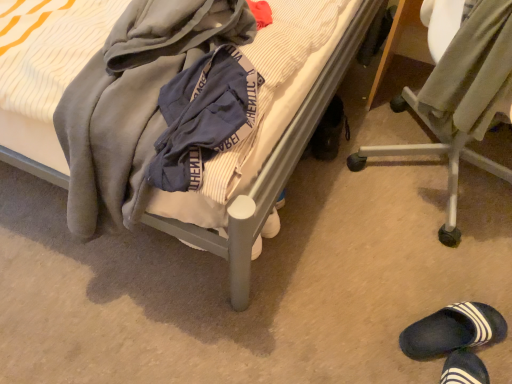
In order to face metallic silver chair at lower right, should I rotate leftwards or rightwards?

Turn right approximately 28.414 degrees to face it.

What is the approximate height of light olive-green fabric at right, which is the first clothing in right-to-left order?

light olive-green fabric at right, which is the first clothing in right-to-left order, is 14.81 inches tall.

Image resolution: width=512 pixels, height=384 pixels. What do you see at coordinates (271, 170) in the screenshot? I see `soft gray blanket at center` at bounding box center [271, 170].

You are a GUI agent. You are given a task and a screenshot of the screen. Output one action in this format:
    pyautogui.click(x=<x>, y=<y>)
    Task: Click on the metallic silver chair at lower right
    The width and height of the screenshot is (512, 384).
    Given the screenshot: What is the action you would take?
    pyautogui.click(x=458, y=93)

Which object is further away from the camera, metallic silver chair at lower right or soft gray blanket at center?

Positioned behind is metallic silver chair at lower right.

Measure the distance between metallic silver chair at lower right and soft gray blanket at center.

The distance of metallic silver chair at lower right from soft gray blanket at center is 14.63 inches.

The width and height of the screenshot is (512, 384). Find the location of `chair below the soft gray blanket at center (from a real-world perspective)`. chair below the soft gray blanket at center (from a real-world perspective) is located at coordinates pyautogui.click(x=458, y=93).

Which is correct: metallic silver chair at lower right is inside soft gray blanket at center, or outside of it?

metallic silver chair at lower right is spatially situated outside soft gray blanket at center.

Would you say black rubber shoe at lower right, positioned as the second footwear in right-to-left order, is a long distance from light olive-green fabric at right, which is the second clothing in left-to-right order?

Actually, black rubber shoe at lower right, positioned as the second footwear in right-to-left order, and light olive-green fabric at right, which is the second clothing in left-to-right order, are a little close together.

Considering the positions of point (345, 132) and point (482, 122), is point (345, 132) closer or farther from the camera than point (482, 122)?

Point (345, 132) is farther from the camera than point (482, 122).

Is black rubber shoe at lower right, acting as the 2th footwear starting from the front, bigger than light olive-green fabric at right, which is the first clothing in right-to-left order?

No, black rubber shoe at lower right, acting as the 2th footwear starting from the front, is not bigger than light olive-green fabric at right, which is the first clothing in right-to-left order.

Can we say black rubber shoe at lower right, marked as the first footwear in a left-to-right arrangement, lies outside light olive-green fabric at right, which is the second clothing in left-to-right order?

Yes, black rubber shoe at lower right, marked as the first footwear in a left-to-right arrangement, is not within light olive-green fabric at right, which is the second clothing in left-to-right order.

Could you tell me if dark blue rubber slipper at lower right, the 2th footwear from the top, is facing metallic silver chair at lower right?

No, dark blue rubber slipper at lower right, the 2th footwear from the top, is not aimed at metallic silver chair at lower right.

Is point (436, 343) more distant than point (468, 140)?

Yes, point (436, 343) is farther from viewer.

From a real-world perspective, which object rests below the other?

dark blue rubber slipper at lower right, which appears as the 1th footwear when viewed from the front.

Is dark blue rubber slipper at lower right, marked as the 1th footwear in a right-to-left arrangement, positioned beyond the bounds of metallic silver chair at lower right?

Indeed, dark blue rubber slipper at lower right, marked as the 1th footwear in a right-to-left arrangement, is completely outside metallic silver chair at lower right.

Who is bigger, light olive-green fabric at right, which is the second clothing in left-to-right order, or soft gray hoodie at center, acting as the first clothing starting from the left?

Bigger between the two is light olive-green fabric at right, which is the second clothing in left-to-right order.

Does point (511, 20) lie behind point (175, 25)?

That is False.

Which is correct: light olive-green fabric at right, which is the first clothing in right-to-left order, is inside soft gray hoodie at center, acting as the first clothing starting from the left, or outside of it?

light olive-green fabric at right, which is the first clothing in right-to-left order, is spatially situated outside soft gray hoodie at center, acting as the first clothing starting from the left.

Which of these two, light olive-green fabric at right, which is the second clothing in left-to-right order, or soft gray hoodie at center, acting as the first clothing starting from the left, stands taller?

light olive-green fabric at right, which is the second clothing in left-to-right order.

In terms of height, does soft gray blanket at center look taller or shorter compared to dark blue rubber slipper at lower right, the first footwear ordered from the bottom?

Considering their sizes, soft gray blanket at center has more height than dark blue rubber slipper at lower right, the first footwear ordered from the bottom.

Considering the positions of point (259, 203) and point (468, 305), is point (259, 203) closer or farther from the camera than point (468, 305)?

Point (259, 203).

From the image's perspective, does soft gray blanket at center appear lower than dark blue rubber slipper at lower right, marked as the 1th footwear in a right-to-left arrangement?

No.

Which object is more forward, soft gray blanket at center or dark blue rubber slipper at lower right, marked as the 1th footwear in a right-to-left arrangement?

soft gray blanket at center.

From the image's perspective, which one is positioned higher, soft gray hoodie at center, the 2th clothing viewed from the right, or dark blue rubber slipper at lower right, the 2th footwear from the left?

soft gray hoodie at center, the 2th clothing viewed from the right, is shown above in the image.

Is soft gray hoodie at center, acting as the first clothing starting from the left, next to dark blue rubber slipper at lower right, the 2th footwear positioned from the back?

No, soft gray hoodie at center, acting as the first clothing starting from the left, is not beside dark blue rubber slipper at lower right, the 2th footwear positioned from the back.

Based on their positions, is soft gray hoodie at center, acting as the first clothing starting from the left, located to the left or right of dark blue rubber slipper at lower right, which appears as the 1th footwear when viewed from the front?

From the image, it's evident that soft gray hoodie at center, acting as the first clothing starting from the left, is to the left of dark blue rubber slipper at lower right, which appears as the 1th footwear when viewed from the front.

Which object is positioned more to the left, metallic silver chair at lower right or dark blue rubber slipper at lower right, marked as the 1th footwear in a right-to-left arrangement?

Positioned to the left is dark blue rubber slipper at lower right, marked as the 1th footwear in a right-to-left arrangement.

Considering their positions, is metallic silver chair at lower right located in front of or behind dark blue rubber slipper at lower right, which appears as the 1th footwear when viewed from the front?

metallic silver chair at lower right is in front of dark blue rubber slipper at lower right, which appears as the 1th footwear when viewed from the front.

Is metallic silver chair at lower right shorter than dark blue rubber slipper at lower right, marked as the 1th footwear in a right-to-left arrangement?

No, metallic silver chair at lower right is not shorter than dark blue rubber slipper at lower right, marked as the 1th footwear in a right-to-left arrangement.

The width and height of the screenshot is (512, 384). I want to click on bed on the left of the metallic silver chair at lower right, so click(271, 170).

You are a GUI agent. You are given a task and a screenshot of the screen. Output one action in this format:
    pyautogui.click(x=<x>, y=<y>)
    Task: Click on the clothing that is the 1st object above the black rubber shoe at lower right, marked as the first footwear in a left-to-right arrangement (from a real-world perspective)
    
    Given the screenshot: What is the action you would take?
    pyautogui.click(x=473, y=72)

Estimate the real-world distances between objects in this image. Which object is closer to soft gray hoodie at center, acting as the first clothing starting from the left, black rubber shoe at lower right, which is counted as the 2th footwear, starting from the bottom, or soft gray blanket at center?

The object closer to soft gray hoodie at center, acting as the first clothing starting from the left, is soft gray blanket at center.

Looking at the image, which one is located closer to light olive-green fabric at right, which is the second clothing in left-to-right order, black rubber shoe at lower right, which appears as the 1th footwear when viewed from the back, or dark blue rubber slipper at lower right, marked as the 1th footwear in a right-to-left arrangement?

dark blue rubber slipper at lower right, marked as the 1th footwear in a right-to-left arrangement.

From the image, which object appears to be farther from soft gray hoodie at center, the 2th clothing viewed from the right, black rubber shoe at lower right, which appears as the 1th footwear when viewed from the back, or dark blue rubber slipper at lower right, the first footwear ordered from the bottom?

dark blue rubber slipper at lower right, the first footwear ordered from the bottom.

Estimate the real-world distances between objects in this image. Which object is closer to metallic silver chair at lower right, black rubber shoe at lower right, the 1th footwear from the top, or light olive-green fabric at right, which is the second clothing in left-to-right order?

light olive-green fabric at right, which is the second clothing in left-to-right order, is closer to metallic silver chair at lower right.

Looking at the image, which one is located further to soft gray hoodie at center, the 2th clothing viewed from the right, dark blue rubber slipper at lower right, the 2th footwear positioned from the back, or black rubber shoe at lower right, which appears as the 1th footwear when viewed from the back?

The object further to soft gray hoodie at center, the 2th clothing viewed from the right, is dark blue rubber slipper at lower right, the 2th footwear positioned from the back.

Considering their positions, is black rubber shoe at lower right, which appears as the 1th footwear when viewed from the back, positioned closer to dark blue rubber slipper at lower right, the 2th footwear from the left, than soft gray blanket at center?

Among the two, soft gray blanket at center is located nearer to dark blue rubber slipper at lower right, the 2th footwear from the left.

In the scene shown: Estimate the real-world distances between objects in this image. Which object is further from soft gray blanket at center, black rubber shoe at lower right, which appears as the 1th footwear when viewed from the back, or light olive-green fabric at right, which is the first clothing in right-to-left order?

The object further to soft gray blanket at center is black rubber shoe at lower right, which appears as the 1th footwear when viewed from the back.

Estimate the real-world distances between objects in this image. Which object is further from dark blue rubber slipper at lower right, which appears as the 1th footwear when viewed from the front, metallic silver chair at lower right or soft gray blanket at center?

Based on the image, soft gray blanket at center appears to be further to dark blue rubber slipper at lower right, which appears as the 1th footwear when viewed from the front.

Locate an element on the screen. clothing between soft gray hoodie at center, the 2th clothing viewed from the right, and dark blue rubber slipper at lower right, the 2th footwear from the left is located at coordinates (473, 72).

You are a GUI agent. You are given a task and a screenshot of the screen. Output one action in this format:
    pyautogui.click(x=<x>, y=<y>)
    Task: Click on the footwear situated between soft gray blanket at center and light olive-green fabric at right, which is the second clothing in left-to-right order, from left to right
    
    Given the screenshot: What is the action you would take?
    pyautogui.click(x=329, y=132)

This screenshot has height=384, width=512. Identify the location of clothing between soft gray hoodie at center, acting as the first clothing starting from the left, and metallic silver chair at lower right, in the horizontal direction. (473, 72).

The height and width of the screenshot is (384, 512). In order to click on footwear between soft gray blanket at center and dark blue rubber slipper at lower right, marked as the 1th footwear in a right-to-left arrangement, from left to right in this screenshot , I will do `click(329, 132)`.